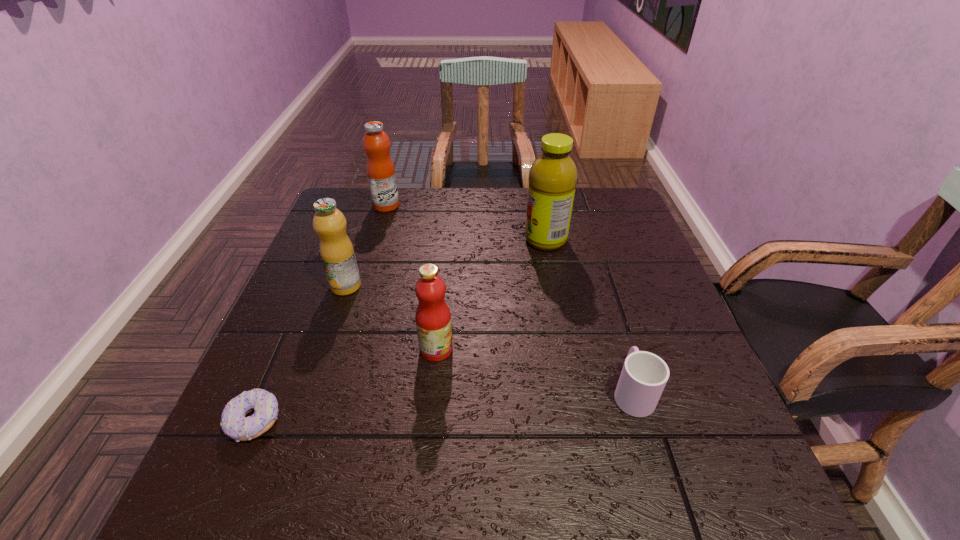
Identify the location of free space located 0.300m on the front label of the second farthest object. (414, 240).

Locate an element on the screen. Image resolution: width=960 pixels, height=540 pixels. vacant space located 0.310m on the front label of the second farthest object is located at coordinates (411, 240).

Find the location of a particular element. This screenshot has height=540, width=960. vacant space located 0.220m on the front label of the farthest fruit juice is located at coordinates (472, 206).

I want to click on vacant space situated on the front label of the third farthest object, so click(310, 390).

In order to click on free space located 0.170m on the front label of the fourth object from left to right in this screenshot , I will do `click(535, 349)`.

At what (x,y) coordinates should I click in order to perform the action: click on free space located 0.230m with the handle on the side of the second shortest object. Please return your answer as a coordinate pair (x, y). Looking at the image, I should click on (601, 291).

Where is `vacant position located 0.060m with the handle on the side of the second shortest object`? The height and width of the screenshot is (540, 960). vacant position located 0.060m with the handle on the side of the second shortest object is located at coordinates (618, 345).

At what (x,y) coordinates should I click in order to perform the action: click on free spot located 0.260m with the handle on the side of the second shortest object. Please return your answer as a coordinate pair (x, y). Image resolution: width=960 pixels, height=540 pixels. Looking at the image, I should click on (599, 282).

Find the location of `free space located on the back of the shortest object`. free space located on the back of the shortest object is located at coordinates (320, 268).

The width and height of the screenshot is (960, 540). I want to click on doughnut that is at the left edge, so click(x=234, y=423).